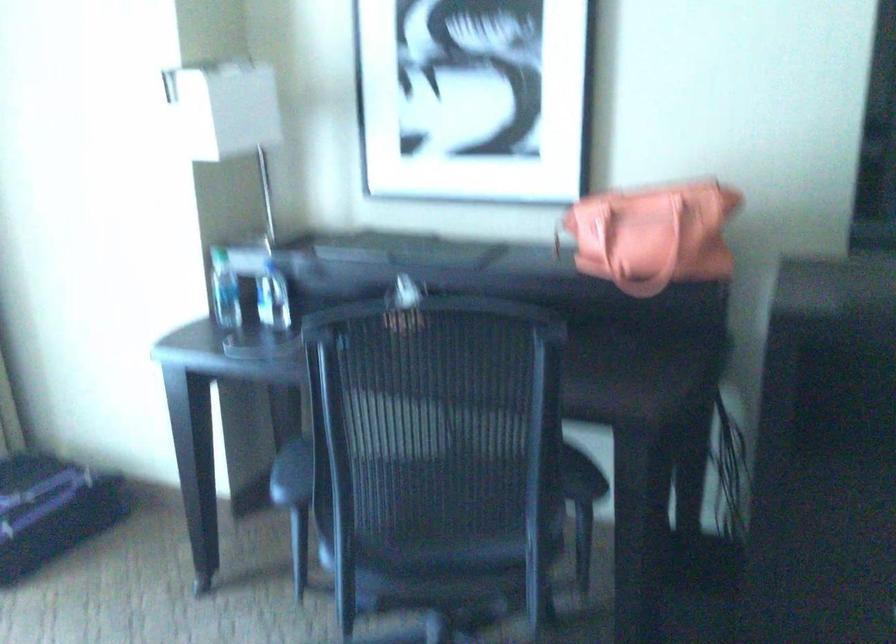
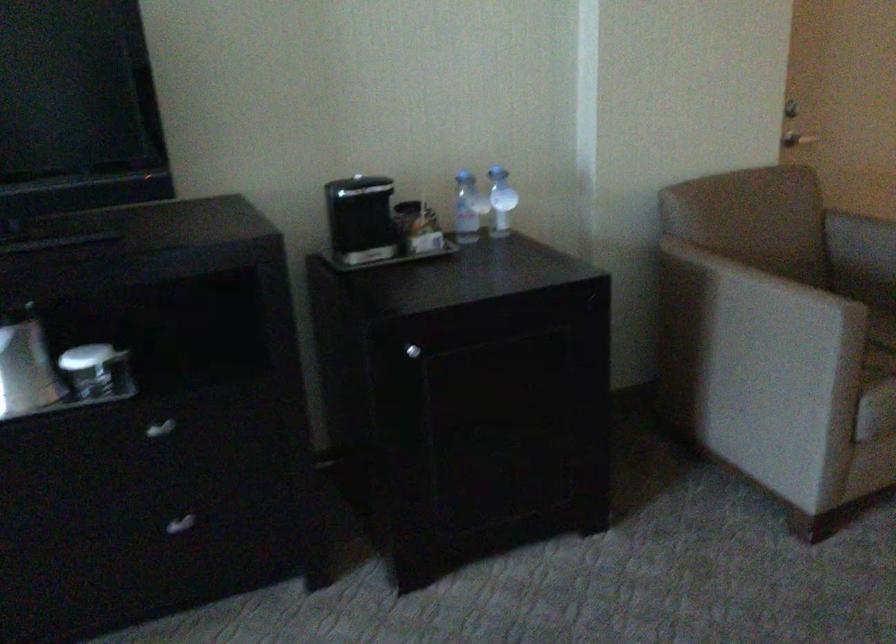
Question: How did the camera likely rotate?

Choices:
 (A) Left
 (B) Right
 (C) Up
 (D) Down

Answer: (B)